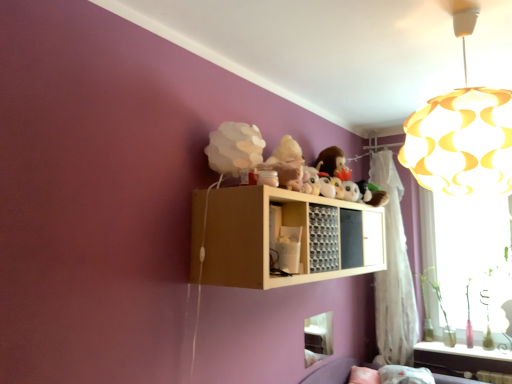
Question: Does translucent glass bottles at lower right have a lesser height compared to yellow paper lampshade at upper right?

Choices:
 (A) no
 (B) yes

Answer: (B)

Question: From a real-world perspective, is translucent glass bottles at lower right beneath yellow paper lampshade at upper right?

Choices:
 (A) yes
 (B) no

Answer: (A)

Question: Does translucent glass bottles at lower right have a greater width compared to yellow paper lampshade at upper right?

Choices:
 (A) yes
 (B) no

Answer: (B)

Question: Does translucent glass bottles at lower right turn towards yellow paper lampshade at upper right?

Choices:
 (A) no
 (B) yes

Answer: (A)

Question: Considering the relative sizes of translucent glass bottles at lower right and yellow paper lampshade at upper right in the image provided, is translucent glass bottles at lower right bigger than yellow paper lampshade at upper right?

Choices:
 (A) no
 (B) yes

Answer: (A)

Question: Are translucent glass bottles at lower right and yellow paper lampshade at upper right far apart?

Choices:
 (A) no
 (B) yes

Answer: (B)

Question: Is transparent glass window at right, placed as the 1th window screen when sorted from right to left, completely or partially inside fuzzy fabric plush at upper center?

Choices:
 (A) no
 (B) yes

Answer: (A)

Question: From the image's perspective, is fuzzy fabric plush at upper center on top of transparent glass window at right, placed as the second window screen when sorted from left to right?

Choices:
 (A) no
 (B) yes

Answer: (B)

Question: Can you confirm if fuzzy fabric plush at upper center is smaller than transparent glass window at right, placed as the 1th window screen when sorted from right to left?

Choices:
 (A) yes
 (B) no

Answer: (A)

Question: Are fuzzy fabric plush at upper center and transparent glass window at right, placed as the 1th window screen when sorted from right to left, located far from each other?

Choices:
 (A) yes
 (B) no

Answer: (A)

Question: From a real-world perspective, is fuzzy fabric plush at upper center located higher than transparent glass window at right, the 1th window screen viewed from the back?

Choices:
 (A) yes
 (B) no

Answer: (A)

Question: Considering the relative positions of fuzzy fabric plush at upper center and transparent glass window at right, which is counted as the 2th window screen, starting from the front, in the image provided, is fuzzy fabric plush at upper center to the left of transparent glass window at right, which is counted as the 2th window screen, starting from the front, from the viewer's perspective?

Choices:
 (A) no
 (B) yes

Answer: (B)

Question: Are transparent glass window at right, placed as the second window screen when sorted from left to right, and light wood shelf at upper center far apart?

Choices:
 (A) no
 (B) yes

Answer: (B)